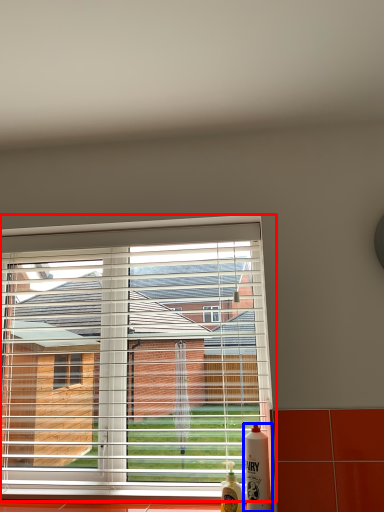
Question: Which of the following is the farthest to the observer, window (highlighted by a red box) or bottle (highlighted by a blue box)?

Choices:
 (A) window
 (B) bottle

Answer: (A)